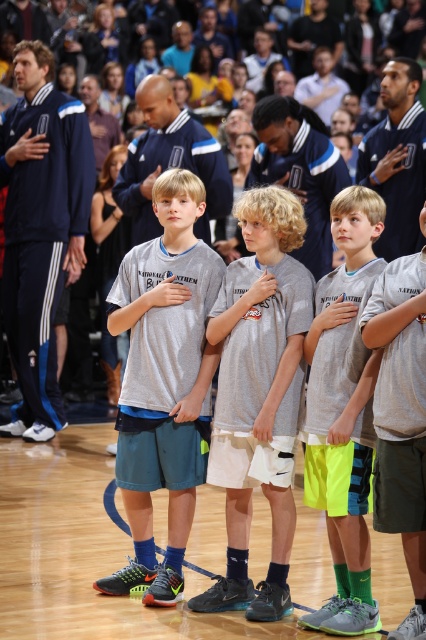
Question: In this image, where is neon yellow shorts at center located relative to neon green shorts at center?

Choices:
 (A) left
 (B) right

Answer: (A)

Question: Which point appears closest to the camera in this image?

Choices:
 (A) (267, 308)
 (B) (158, 179)
 (C) (412, 529)
 (D) (379, 225)

Answer: (C)

Question: Which object is farther from the camera taking this photo?

Choices:
 (A) neon green shorts at center
 (B) gray matte jersey at center
 (C) neon yellow shorts at center
 (D) gray fabric shirt at center

Answer: (D)

Question: In this image, where is gray fabric shirt at center located relative to neon green shorts at center?

Choices:
 (A) below
 (B) above

Answer: (B)

Question: Does gray fabric shirt at center appear under neon yellow shorts at center?

Choices:
 (A) yes
 (B) no

Answer: (B)

Question: Which is farther from the gray fabric shirt at center?

Choices:
 (A) neon green shorts at center
 (B) gray matte jersey at center

Answer: (A)